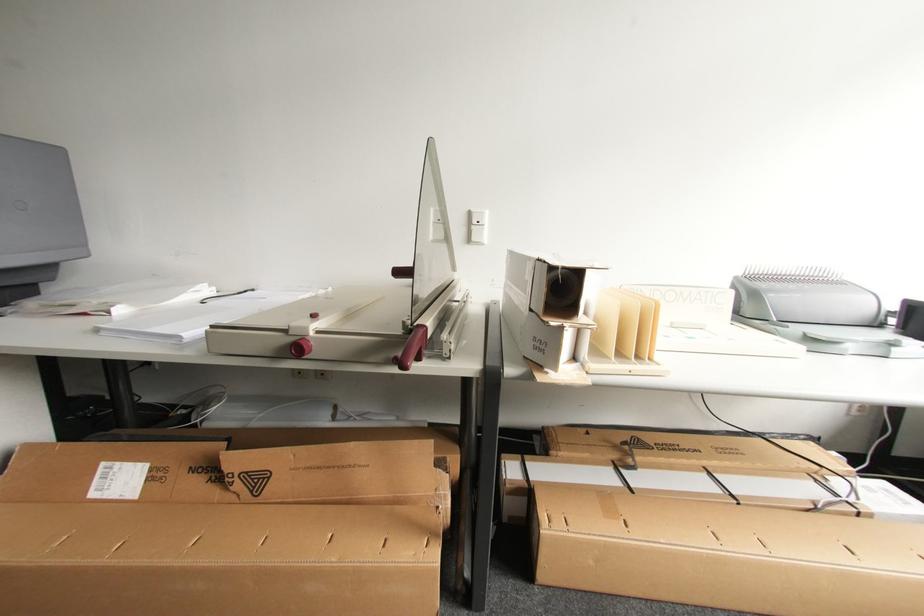
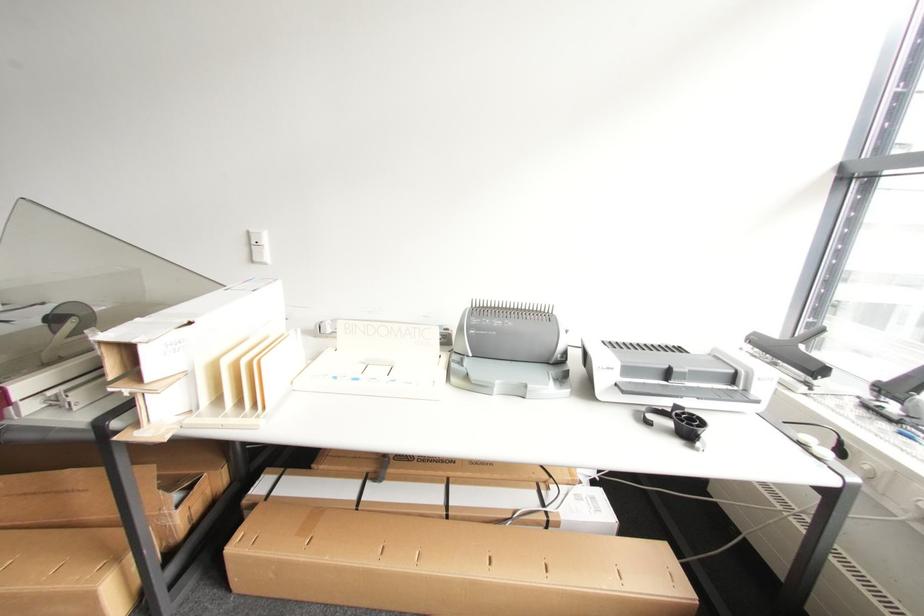
Find the pixel in the second image that matches (477,227) in the first image.

(257, 248)